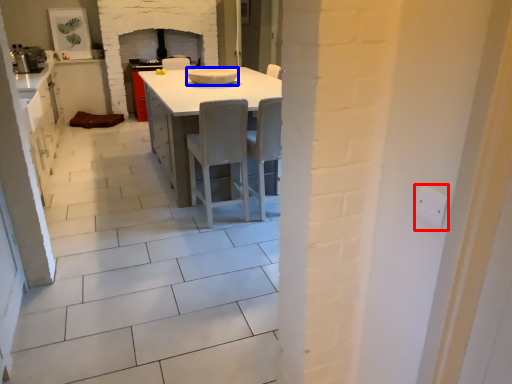
Question: Among these objects, which one is farthest to the camera, electric outlet (highlighted by a red box) or appliance (highlighted by a blue box)?

Choices:
 (A) electric outlet
 (B) appliance

Answer: (B)